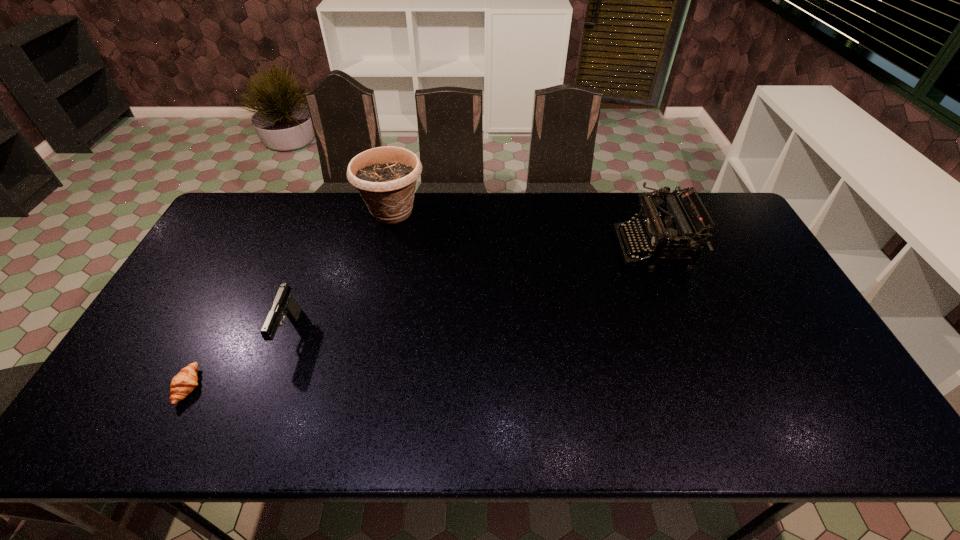
Find the location of `the second object from right to left`. the second object from right to left is located at coordinates (385, 177).

Where is `typewriter`? typewriter is located at coordinates (655, 226).

Where is `the third object from right to left`? Image resolution: width=960 pixels, height=540 pixels. the third object from right to left is located at coordinates [284, 304].

Identify the location of the third tallest object. (284, 304).

The width and height of the screenshot is (960, 540). In order to click on the leftmost object in this screenshot , I will do `click(182, 384)`.

Find the location of a particular element. Image resolution: width=960 pixels, height=540 pixels. the shortest object is located at coordinates tap(182, 384).

The image size is (960, 540). In order to click on free space located on the right of the third object from left to right in this screenshot , I will do `click(461, 212)`.

Find the location of a particular element. This screenshot has width=960, height=540. vacant area located 0.290m on the keyboard of the typewriter is located at coordinates (528, 248).

Locate an element on the screen. vacant area situated on the keyboard of the typewriter is located at coordinates (599, 248).

Where is `free point located on the keyboard of the typewriter`? Image resolution: width=960 pixels, height=540 pixels. free point located on the keyboard of the typewriter is located at coordinates (x=521, y=248).